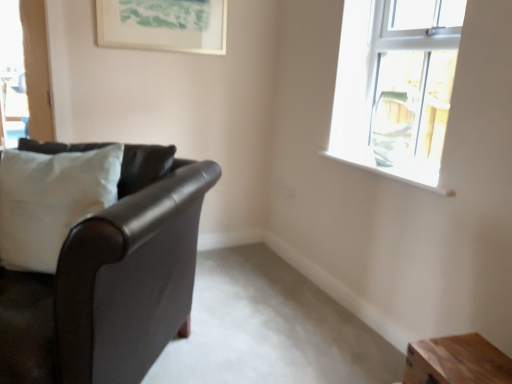
Measure the distance between white fabric pillow at left and camera.

A distance of 1.51 meters exists between white fabric pillow at left and camera.

The height and width of the screenshot is (384, 512). Describe the element at coordinates (163, 25) in the screenshot. I see `matte white picture frame at upper center` at that location.

This screenshot has width=512, height=384. I want to click on wooden table at lower right, so click(x=456, y=361).

Can you tell me how much clear glass window at upper right and leather couch at left differ in facing direction?

The angular difference between clear glass window at upper right and leather couch at left is 46.6 degrees.

Which object is wider, clear glass window at upper right or leather couch at left?

leather couch at left.

Which is closer, (392,11) or (176,265)?

Point (392,11).

Does clear glass window at upper right have a larger size compared to leather couch at left?

Actually, clear glass window at upper right might be smaller than leather couch at left.

From the image's perspective, between white fabric swivel chair at upper right and white smooth window sill at upper right, which one is located above?

white fabric swivel chair at upper right.

From the picture: Is white smooth window sill at upper right at the back of white fabric swivel chair at upper right?

No, white smooth window sill at upper right is not at the back of white fabric swivel chair at upper right.

Does white fabric swivel chair at upper right have a lesser height compared to white smooth window sill at upper right?

In fact, white fabric swivel chair at upper right may be taller than white smooth window sill at upper right.

Between white fabric swivel chair at upper right and white smooth window sill at upper right, which one appears on the left side from the viewer's perspective?

From the viewer's perspective, white smooth window sill at upper right appears more on the left side.

Image resolution: width=512 pixels, height=384 pixels. I want to click on window sill located above the leather couch at left (from the image's perspective), so click(x=390, y=175).

Would you say white smooth window sill at upper right is inside or outside leather couch at left?

white smooth window sill at upper right lies outside leather couch at left.

Is the depth of white smooth window sill at upper right greater than that of leather couch at left?

Yes, it is behind leather couch at left.

Which object is wider, white smooth window sill at upper right or leather couch at left?

leather couch at left.

From a real-world perspective, is matte white picture frame at upper center physically located above or below white fabric swivel chair at upper right?

In terms of real-world spatial position, matte white picture frame at upper center is above white fabric swivel chair at upper right.

Is matte white picture frame at upper center positioned with its back to white fabric swivel chair at upper right?

No, matte white picture frame at upper center is not facing away from white fabric swivel chair at upper right.

I want to click on swivel chair below the matte white picture frame at upper center (from a real-world perspective), so click(391, 127).

Based on the photo, is matte white picture frame at upper center in contact with white fabric swivel chair at upper right?

No, matte white picture frame at upper center is not next to white fabric swivel chair at upper right.

Who is shorter, white smooth window sill at upper right or white fabric pillow at left?

With less height is white smooth window sill at upper right.

Where is `window sill above the white fabric pillow at left (from the image's perspective)`? window sill above the white fabric pillow at left (from the image's perspective) is located at coordinates (390, 175).

Is point (415, 183) positioned in front of point (48, 195)?

No, (415, 183) is further to viewer.

What's the angular difference between white smooth window sill at upper right and white fabric pillow at left's facing directions?

46.6 degrees separate the facing orientations of white smooth window sill at upper right and white fabric pillow at left.

From the image's perspective, which object appears higher, matte white picture frame at upper center or clear glass window at upper right?

matte white picture frame at upper center, from the image's perspective.

Can we say matte white picture frame at upper center lies outside clear glass window at upper right?

Yes.

Would you consider matte white picture frame at upper center to be distant from clear glass window at upper right?

Yes, matte white picture frame at upper center and clear glass window at upper right are located far from each other.

Which object is further away from the camera, matte white picture frame at upper center or clear glass window at upper right?

matte white picture frame at upper center is further from the camera.

From the image's perspective, which one is positioned lower, clear glass window at upper right or white fabric swivel chair at upper right?

white fabric swivel chair at upper right, from the image's perspective.

From the picture: Is clear glass window at upper right to the left of white fabric swivel chair at upper right from the viewer's perspective?

Incorrect, clear glass window at upper right is not on the left side of white fabric swivel chair at upper right.

Is clear glass window at upper right spatially inside white fabric swivel chair at upper right, or outside of it?

clear glass window at upper right cannot be found inside white fabric swivel chair at upper right.

Locate an element on the screen. This screenshot has height=384, width=512. studio couch below the clear glass window at upper right (from the image's perspective) is located at coordinates (111, 280).

Locate an element on the screen. The height and width of the screenshot is (384, 512). swivel chair on the right side of white smooth window sill at upper right is located at coordinates (391, 127).

When comparing their distances from wooden table at lower right, does white smooth window sill at upper right or clear glass window at upper right seem closer?

white smooth window sill at upper right lies closer to wooden table at lower right than the other object.

Which object lies nearer to the anchor point clear glass window at upper right, wooden table at lower right or white fabric pillow at left?

The object closer to clear glass window at upper right is wooden table at lower right.

From the image, which object appears to be nearer to leather couch at left, clear glass window at upper right or white smooth window sill at upper right?

clear glass window at upper right.

Looking at the image, which one is located closer to leather couch at left, white fabric swivel chair at upper right or white fabric pillow at left?

white fabric pillow at left lies closer to leather couch at left than the other object.

When comparing their distances from clear glass window at upper right, does wooden table at lower right or white smooth window sill at upper right seem further?

wooden table at lower right.

Looking at the image, which one is located further to white fabric pillow at left, white fabric swivel chair at upper right or wooden table at lower right?

white fabric swivel chair at upper right lies further to white fabric pillow at left than the other object.

Based on their spatial positions, is white fabric swivel chair at upper right or white fabric pillow at left closer to wooden table at lower right?

Based on the image, white fabric swivel chair at upper right appears to be nearer to wooden table at lower right.

Based on the photo, which object lies further to the anchor point white smooth window sill at upper right, leather couch at left or white fabric pillow at left?

The object further to white smooth window sill at upper right is white fabric pillow at left.

At what (x,y) coordinates should I click in order to perform the action: click on table located between leather couch at left and white fabric swivel chair at upper right in the left-right direction. Please return your answer as a coordinate pair (x, y). This screenshot has width=512, height=384. Looking at the image, I should click on (456, 361).

This screenshot has height=384, width=512. Identify the location of picture frame between white fabric pillow at left and white fabric swivel chair at upper right from left to right. (163, 25).

The width and height of the screenshot is (512, 384). Identify the location of window sill between white fabric pillow at left and white fabric swivel chair at upper right from left to right. (390, 175).

The width and height of the screenshot is (512, 384). In order to click on window sill between leather couch at left and white fabric swivel chair at upper right in this screenshot , I will do `click(390, 175)`.